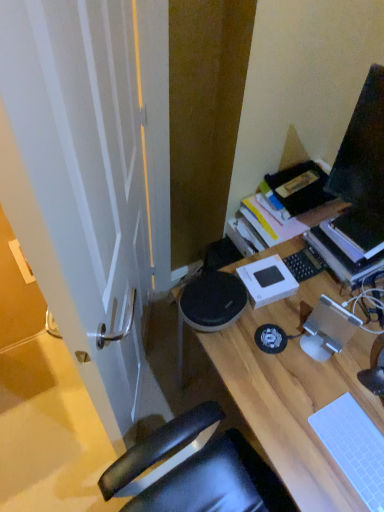
The image size is (384, 512). What do you see at coordinates (342, 257) in the screenshot?
I see `hardcover book at upper right` at bounding box center [342, 257].

The width and height of the screenshot is (384, 512). What are the coordinates of `white matte laptop keyboard at lower right, which is the first laptop keyboard in front-to-back order` in the screenshot? It's located at (354, 447).

Locate an element on the screen. hardcover book at upper right is located at coordinates (342, 257).

Looking at this image, do you think hardcover book at upper right is within black matte laptop keyboard at center-right, the 2th laptop keyboard when ordered from front to back, or outside of it?

hardcover book at upper right cannot be found inside black matte laptop keyboard at center-right, the 2th laptop keyboard when ordered from front to back.

Is hardcover book at upper right beside black matte laptop keyboard at center-right, the 2th laptop keyboard when ordered from front to back?

Yes.

Does hardcover book at upper right turn towards black matte laptop keyboard at center-right, placed as the 1th laptop keyboard when sorted from top to bottom?

Yes, hardcover book at upper right is facing black matte laptop keyboard at center-right, placed as the 1th laptop keyboard when sorted from top to bottom.

Is white matte laptop keyboard at lower right, the second laptop keyboard when ordered from back to front, facing towards black matte laptop keyboard at center-right, placed as the 1th laptop keyboard when sorted from top to bottom?

No, white matte laptop keyboard at lower right, the second laptop keyboard when ordered from back to front, is not turned towards black matte laptop keyboard at center-right, placed as the 1th laptop keyboard when sorted from top to bottom.

From a real-world perspective, is white matte laptop keyboard at lower right, placed as the second laptop keyboard when sorted from top to bottom, above or below black matte laptop keyboard at center-right, which is the second laptop keyboard in bottom-to-top order?

In terms of real-world spatial position, white matte laptop keyboard at lower right, placed as the second laptop keyboard when sorted from top to bottom, is below black matte laptop keyboard at center-right, which is the second laptop keyboard in bottom-to-top order.

Is white matte laptop keyboard at lower right, the second laptop keyboard when ordered from back to front, inside the boundaries of black matte laptop keyboard at center-right, the 2th laptop keyboard when ordered from front to back, or outside?

white matte laptop keyboard at lower right, the second laptop keyboard when ordered from back to front, is located beyond the bounds of black matte laptop keyboard at center-right, the 2th laptop keyboard when ordered from front to back.

Is white matte laptop keyboard at lower right, the second laptop keyboard when ordered from back to front, thinner than black matte laptop keyboard at center-right, placed as the 1th laptop keyboard when sorted from top to bottom?

In fact, white matte laptop keyboard at lower right, the second laptop keyboard when ordered from back to front, might be wider than black matte laptop keyboard at center-right, placed as the 1th laptop keyboard when sorted from top to bottom.

Is black matte laptop keyboard at center-right, the 2th laptop keyboard when ordered from front to back, thinner than hardcover book at upper right?

Correct, the width of black matte laptop keyboard at center-right, the 2th laptop keyboard when ordered from front to back, is less than that of hardcover book at upper right.

Which object is closer to the camera taking this photo, black matte laptop keyboard at center-right, the 2th laptop keyboard when ordered from front to back, or hardcover book at upper right?

hardcover book at upper right is more forward.

Considering the positions of points (306, 262) and (344, 256), is point (306, 262) farther from camera compared to point (344, 256)?

Yes.

From a real-world perspective, does black matte laptop keyboard at center-right, which is the second laptop keyboard in bottom-to-top order, sit lower than hardcover book at upper right?

Yes.

From the image's perspective, between white matte laptop keyboard at lower right, which is the first laptop keyboard in front-to-back order, and wooden desk at center, which one is located above?

white matte laptop keyboard at lower right, which is the first laptop keyboard in front-to-back order.

Is white matte laptop keyboard at lower right, the first laptop keyboard ordered from the bottom, oriented towards wooden desk at center?

No, white matte laptop keyboard at lower right, the first laptop keyboard ordered from the bottom, is not facing towards wooden desk at center.

Can you tell me how much white matte laptop keyboard at lower right, the first laptop keyboard ordered from the bottom, and wooden desk at center differ in facing direction?

white matte laptop keyboard at lower right, the first laptop keyboard ordered from the bottom, and wooden desk at center are facing 0.612 degrees away from each other.

Relative to wooden desk at center, is white matte laptop keyboard at lower right, the first laptop keyboard ordered from the bottom, in front or behind?

white matte laptop keyboard at lower right, the first laptop keyboard ordered from the bottom, is positioned farther from the viewer than wooden desk at center.

Is white matte laptop keyboard at lower right, placed as the second laptop keyboard when sorted from top to bottom, at the back of hardcover book at upper right?

No, white matte laptop keyboard at lower right, placed as the second laptop keyboard when sorted from top to bottom, is not at the back of hardcover book at upper right.

How many degrees apart are the facing directions of hardcover book at upper right and white matte laptop keyboard at lower right, which is the first laptop keyboard in front-to-back order?

1.01 degrees.

Considering the sizes of objects hardcover book at upper right and white matte laptop keyboard at lower right, which is the first laptop keyboard in front-to-back order, in the image provided, who is smaller, hardcover book at upper right or white matte laptop keyboard at lower right, which is the first laptop keyboard in front-to-back order,?

white matte laptop keyboard at lower right, which is the first laptop keyboard in front-to-back order, is smaller.

Consider the image. Considering the positions of objects hardcover book at upper right and white matte laptop keyboard at lower right, the second laptop keyboard when ordered from back to front, in the image provided, who is more to the left, hardcover book at upper right or white matte laptop keyboard at lower right, the second laptop keyboard when ordered from back to front,?

From the viewer's perspective, white matte laptop keyboard at lower right, the second laptop keyboard when ordered from back to front, appears more on the left side.

Which point is more distant from viewer, (360, 420) or (352, 273)?

The point (352, 273) is farther from the camera.

Is white matte laptop keyboard at lower right, the second laptop keyboard when ordered from back to front, smaller than hardcover book at upper right?

Yes.

Is there a large distance between white matte laptop keyboard at lower right, the first laptop keyboard ordered from the bottom, and hardcover book at upper right?

No, white matte laptop keyboard at lower right, the first laptop keyboard ordered from the bottom, is not far away from hardcover book at upper right.

Is black matte laptop keyboard at center-right, the 2th laptop keyboard when ordered from front to back, to the left of white matte laptop keyboard at lower right, the first laptop keyboard ordered from the bottom, from the viewer's perspective?

Indeed, black matte laptop keyboard at center-right, the 2th laptop keyboard when ordered from front to back, is positioned on the left side of white matte laptop keyboard at lower right, the first laptop keyboard ordered from the bottom.

Which of these two, black matte laptop keyboard at center-right, the 2th laptop keyboard when ordered from front to back, or white matte laptop keyboard at lower right, placed as the second laptop keyboard when sorted from top to bottom, is bigger?

Bigger between the two is white matte laptop keyboard at lower right, placed as the second laptop keyboard when sorted from top to bottom.

Does black matte laptop keyboard at center-right, the 2th laptop keyboard when ordered from front to back, come behind white matte laptop keyboard at lower right, which is the first laptop keyboard in front-to-back order?

Yes, black matte laptop keyboard at center-right, the 2th laptop keyboard when ordered from front to back, is further from the camera.

Find the location of a particular element. This screenshot has height=512, width=384. laptop keyboard above the white matte laptop keyboard at lower right, which is the first laptop keyboard in front-to-back order (from the image's perspective) is located at coordinates (305, 264).

Locate an element on the screen. laptop keyboard that is the 2nd object to the left of the hardcover book at upper right, starting at the anchor is located at coordinates (305, 264).

The height and width of the screenshot is (512, 384). What are the coordinates of `laptop keyboard behind the white matte laptop keyboard at lower right, the first laptop keyboard ordered from the bottom` in the screenshot? It's located at point(305,264).

From the image, which object appears to be farther from wooden desk at center, hardcover book at upper right or white matte laptop keyboard at lower right, which is the first laptop keyboard in front-to-back order?

hardcover book at upper right lies further to wooden desk at center than the other object.

Considering their positions, is hardcover book at upper right positioned closer to black matte laptop keyboard at center-right, which is the second laptop keyboard in bottom-to-top order, than white matte laptop keyboard at lower right, the second laptop keyboard when ordered from back to front?

The object closer to black matte laptop keyboard at center-right, which is the second laptop keyboard in bottom-to-top order, is hardcover book at upper right.

Based on their spatial positions, is wooden desk at center or hardcover book at upper right closer to white matte laptop keyboard at lower right, the first laptop keyboard ordered from the bottom?

wooden desk at center lies closer to white matte laptop keyboard at lower right, the first laptop keyboard ordered from the bottom, than the other object.

Which object lies nearer to the anchor point wooden desk at center, black matte laptop keyboard at center-right, the 2th laptop keyboard when ordered from front to back, or hardcover book at upper right?

black matte laptop keyboard at center-right, the 2th laptop keyboard when ordered from front to back.

When comparing their distances from wooden desk at center, does white matte laptop keyboard at lower right, placed as the second laptop keyboard when sorted from top to bottom, or black matte laptop keyboard at center-right, the 2th laptop keyboard when ordered from front to back, seem closer?

white matte laptop keyboard at lower right, placed as the second laptop keyboard when sorted from top to bottom, lies closer to wooden desk at center than the other object.

Based on the photo, based on their spatial positions, is hardcover book at upper right or black matte laptop keyboard at center-right, placed as the 1th laptop keyboard when sorted from back to front, closer to wooden desk at center?

black matte laptop keyboard at center-right, placed as the 1th laptop keyboard when sorted from back to front, is closer to wooden desk at center.

From the image, which object appears to be nearer to white matte laptop keyboard at lower right, placed as the second laptop keyboard when sorted from top to bottom, black matte laptop keyboard at center-right, placed as the 1th laptop keyboard when sorted from back to front, or hardcover book at upper right?

hardcover book at upper right.

Estimate the real-world distances between objects in this image. Which object is closer to black matte laptop keyboard at center-right, which is the second laptop keyboard in bottom-to-top order, wooden desk at center or white matte laptop keyboard at lower right, which is the first laptop keyboard in front-to-back order?

Based on the image, wooden desk at center appears to be nearer to black matte laptop keyboard at center-right, which is the second laptop keyboard in bottom-to-top order.

Identify the location of laptop keyboard that lies between hardcover book at upper right and white matte laptop keyboard at lower right, the second laptop keyboard when ordered from back to front, from top to bottom. The image size is (384, 512). (305, 264).

I want to click on laptop keyboard that lies between black matte laptop keyboard at center-right, which is the second laptop keyboard in bottom-to-top order, and wooden desk at center from top to bottom, so click(x=354, y=447).